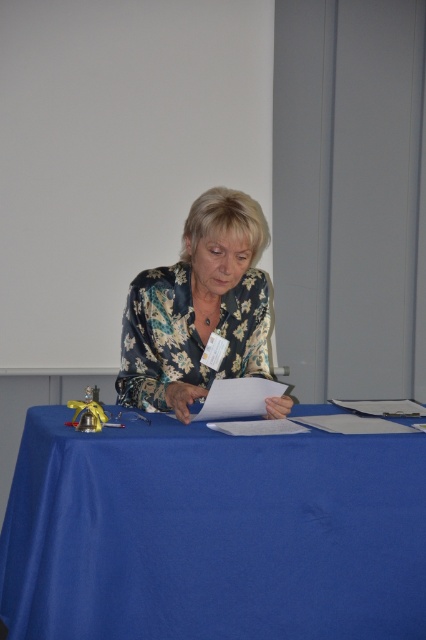
Question: Is blue fabric table at center in front of floral-patterned blouse at center?

Choices:
 (A) no
 (B) yes

Answer: (B)

Question: Does blue fabric table at center have a larger size compared to floral-patterned blouse at center?

Choices:
 (A) yes
 (B) no

Answer: (A)

Question: Which point is farther to the camera?

Choices:
 (A) (42, 481)
 (B) (241, 211)

Answer: (B)

Question: Which point is closer to the camera taking this photo?

Choices:
 (A) (281, 468)
 (B) (242, 355)

Answer: (A)

Question: Does blue fabric table at center have a smaller size compared to floral-patterned blouse at center?

Choices:
 (A) yes
 (B) no

Answer: (B)